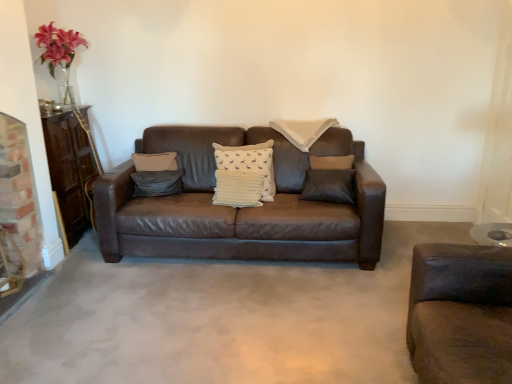
Question: Looking at their shapes, would you say white dotted fabric pillow at center, the 2th pillow when ordered from left to right, is wider or thinner than gray concrete at center?

Choices:
 (A) wide
 (B) thin

Answer: (B)

Question: Based on their positions, is white dotted fabric pillow at center, marked as the 1th pillow in a right-to-left arrangement, located to the left or right of gray concrete at center?

Choices:
 (A) left
 (B) right

Answer: (A)

Question: Which object is positioned farthest from the suede gray pillow at center, which is counted as the 2th pillow, starting from the right?

Choices:
 (A) white dotted fabric pillow at center, the 2th pillow when ordered from left to right
 (B) gray concrete at center

Answer: (B)

Question: Considering the real-world distances, which object is closest to the gray concrete at center?

Choices:
 (A) suede gray pillow at center, which is counted as the 2th pillow, starting from the right
 (B) white dotted fabric pillow at center, marked as the 1th pillow in a right-to-left arrangement

Answer: (B)